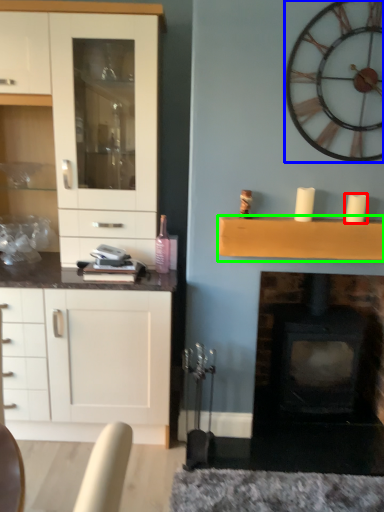
Question: Which object is positioned closest to candle (highlighted by a red box)? Select from wall clock (highlighted by a blue box) and shelf (highlighted by a green box).

Choices:
 (A) wall clock
 (B) shelf

Answer: (B)